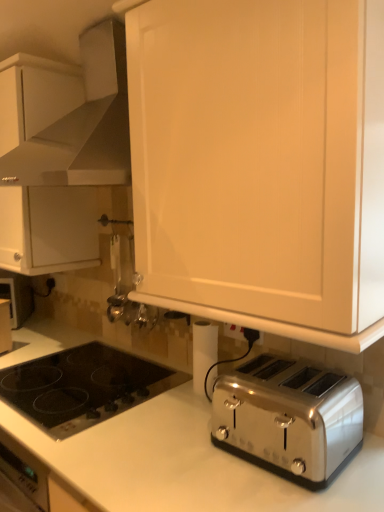
You are a GUI agent. You are given a task and a screenshot of the screen. Output one action in this format:
    pyautogui.click(x=<x>, y=<y>)
    Task: Click on the vacant space underneath satin white range hood at upper center (from a real-world perspective)
    
    Given the screenshot: What is the action you would take?
    pyautogui.click(x=93, y=371)